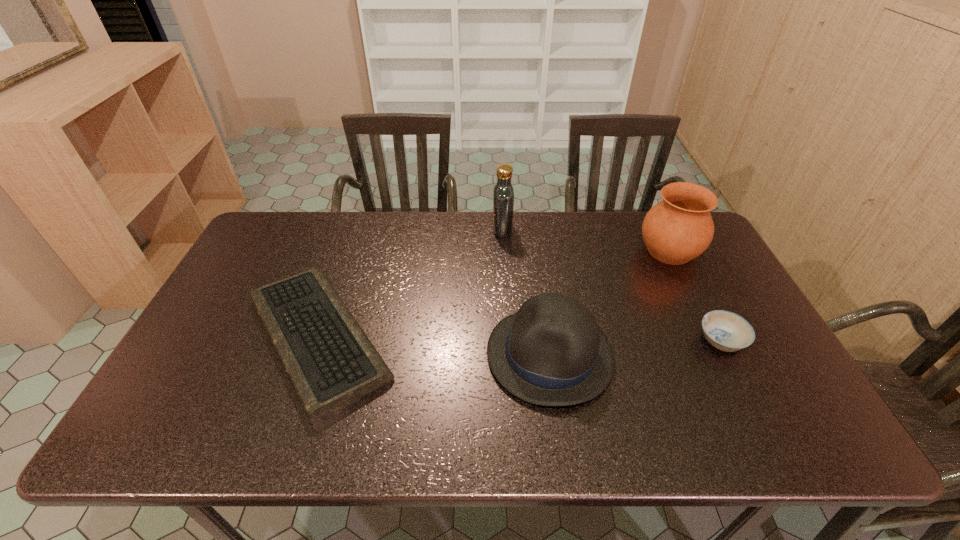
Where is `empty space that is in between the bowl and the pottery`? The width and height of the screenshot is (960, 540). empty space that is in between the bowl and the pottery is located at coordinates (695, 296).

I want to click on vacant space in between the third tallest object and the bowl, so click(x=636, y=347).

Identify the location of free space between the bowl and the vodka. (612, 285).

The height and width of the screenshot is (540, 960). Find the location of `vacant region between the pottery and the vodka`. vacant region between the pottery and the vodka is located at coordinates (586, 240).

Where is `the closest object to the bowl`? The image size is (960, 540). the closest object to the bowl is located at coordinates (679, 228).

Choose which object is the third nearest neighbor to the leftmost object. Please provide its 2D coordinates. Your answer should be formatted as a tuple, i.e. [(x, y)], where the tuple contains the x and y coordinates of a point satisfying the conditions above.

[(679, 228)]

The image size is (960, 540). Identify the location of vacant area in the image that satisfies the following two spatial constraints: 1. on the front-facing side of the pottery; 2. on the right side of the vodka. (504, 251).

Locate an element on the screen. Image resolution: width=960 pixels, height=540 pixels. free region that satisfies the following two spatial constraints: 1. on the front-facing side of the vodka; 2. on the front side of the computer keyboard is located at coordinates (509, 338).

I want to click on free spot that satisfies the following two spatial constraints: 1. on the front side of the pottery; 2. on the front-facing side of the bowler hat, so click(720, 354).

Identify the location of free location that satisfies the following two spatial constraints: 1. on the front-facing side of the vodka; 2. on the left side of the bowl. This screenshot has width=960, height=540. tap(509, 341).